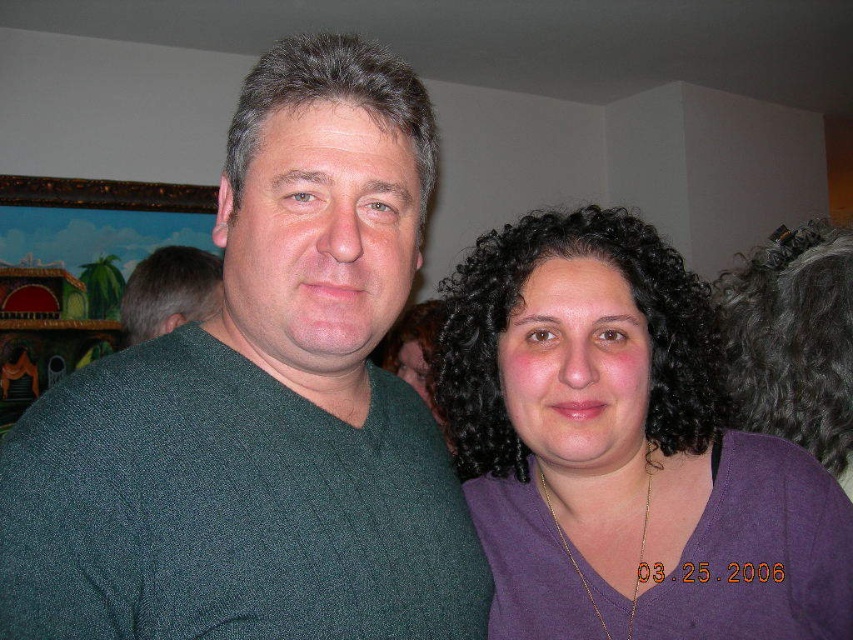
You are standing in a room with two people, a man in a dark green V neck sweater and a woman in a purple top. There is a point marked at coordinates (265, 356). If you want to touch this point with a 65 cm long stick, will the stick reach it?

The point at (265, 356) is 67.13 centimeters from the viewer. Since the stick is only 65 cm long, it will not quite reach the point.

You are standing in front of the image and want to determine which of the two points, point (534, 227) or point (184, 257), is nearer to you. Based on the scene, which point is closer?

Point (534, 227) is closer to the viewer than point (184, 257).

You are taking a photo of the two people in the scene. The camera you are using has a focus point that can only target one object at a time. If you want to ensure both the dark green sweater at center and the purple matte shirt at center are in focus, what should you do?

Since the dark green sweater at center is located above the purple matte shirt at center, you should adjust the camera focus to the middle point between them to ensure both are in focus.